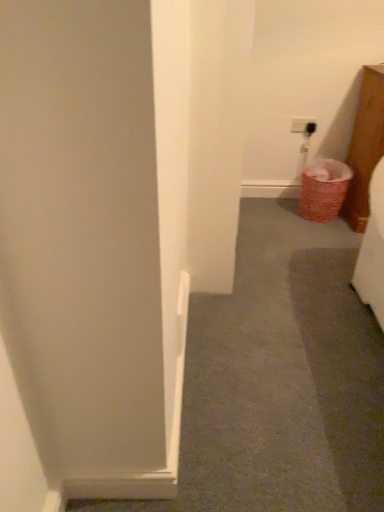
Question: Considering the relative sizes of woven brown laundry basket at lower right and white smooth door at center in the image provided, is woven brown laundry basket at lower right wider than white smooth door at center?

Choices:
 (A) yes
 (B) no

Answer: (B)

Question: Is woven brown laundry basket at lower right surrounding white smooth door at center?

Choices:
 (A) yes
 (B) no

Answer: (B)

Question: Considering the relative positions of woven brown laundry basket at lower right and white smooth door at center in the image provided, is woven brown laundry basket at lower right to the right of white smooth door at center from the viewer's perspective?

Choices:
 (A) no
 (B) yes

Answer: (B)

Question: Does woven brown laundry basket at lower right turn towards white smooth door at center?

Choices:
 (A) yes
 (B) no

Answer: (B)

Question: From a real-world perspective, is woven brown laundry basket at lower right located higher than white smooth door at center?

Choices:
 (A) yes
 (B) no

Answer: (A)

Question: From the image's perspective, does woven brown laundry basket at lower right appear higher than white smooth door at center?

Choices:
 (A) yes
 (B) no

Answer: (A)

Question: Is white smooth door at center oriented away from woven brown laundry basket at lower right?

Choices:
 (A) no
 (B) yes

Answer: (A)

Question: From a real-world perspective, is white smooth door at center positioned under woven brown laundry basket at lower right based on gravity?

Choices:
 (A) no
 (B) yes

Answer: (B)

Question: Does white smooth door at center have a larger size compared to woven brown laundry basket at lower right?

Choices:
 (A) no
 (B) yes

Answer: (B)

Question: Can you confirm if white smooth door at center is wider than woven brown laundry basket at lower right?

Choices:
 (A) no
 (B) yes

Answer: (B)

Question: From a real-world perspective, is white smooth door at center physically above woven brown laundry basket at lower right?

Choices:
 (A) no
 (B) yes

Answer: (A)

Question: Is the position of white smooth door at center more distant than that of woven brown laundry basket at lower right?

Choices:
 (A) no
 (B) yes

Answer: (A)

Question: Is white smooth door at center inside the boundaries of woven brown laundry basket at lower right, or outside?

Choices:
 (A) inside
 (B) outside

Answer: (B)